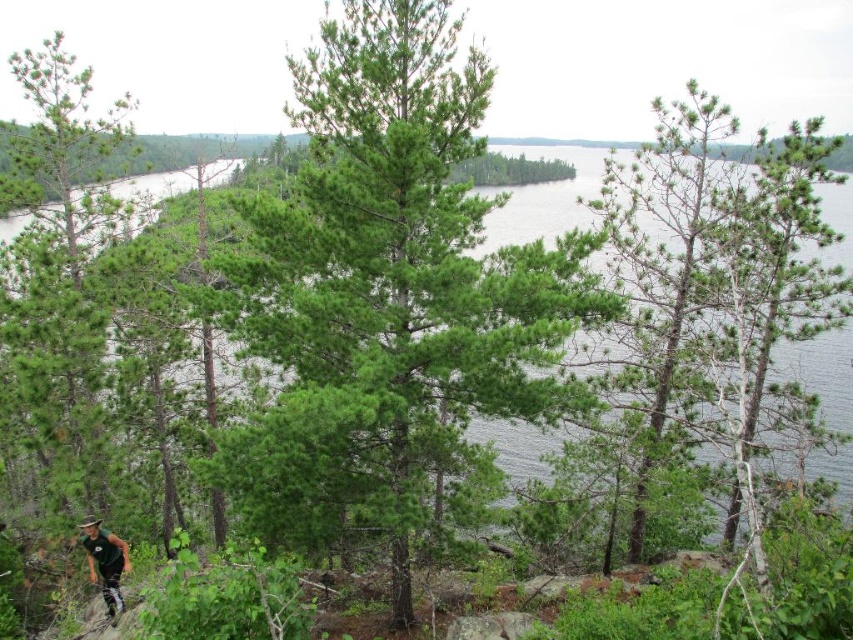
You are planning to take a photo of the green matte tree at center and the green fabric mountain biker at lower left. Since you want both subjects to be clearly visible in the frame, which one should you focus on first to ensure proper focus?

You should focus on the green matte tree at center first because it is larger in size compared to the green fabric mountain biker at lower left, making it easier to achieve sharp focus on its details.